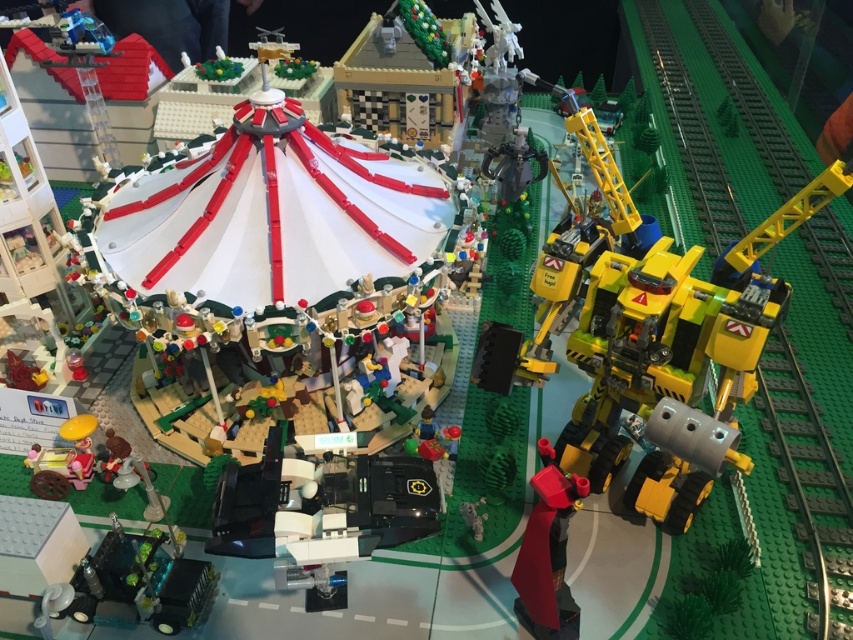
Question: Is green plastic train track at right smaller than smooth red cape at center?

Choices:
 (A) no
 (B) yes

Answer: (A)

Question: Which of the following is the closest to the observer?

Choices:
 (A) green plastic train track at right
 (B) smooth red cape at center

Answer: (B)

Question: Is green plastic train track at right below smooth red cape at center?

Choices:
 (A) no
 (B) yes

Answer: (A)

Question: Does green plastic train track at right have a smaller size compared to smooth red cape at center?

Choices:
 (A) no
 (B) yes

Answer: (A)